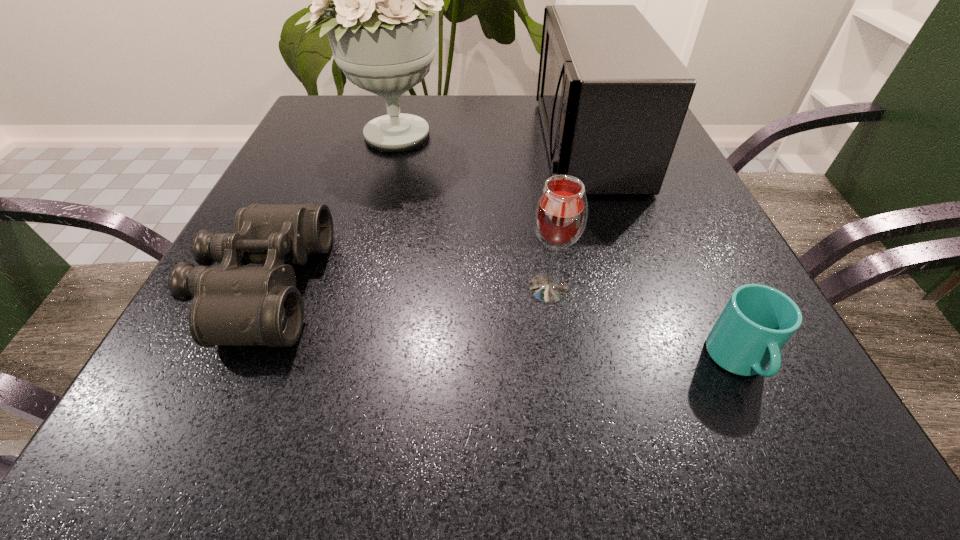
In order to click on bouquet in this screenshot , I will do `click(381, 26)`.

Where is `the fourth shortest object`? the fourth shortest object is located at coordinates (612, 95).

Where is `wineglass`? This screenshot has height=540, width=960. wineglass is located at coordinates tap(560, 213).

This screenshot has width=960, height=540. What are the coordinates of `binoculars` in the screenshot? It's located at (233, 305).

Find the location of `cup`. cup is located at coordinates (757, 321).

This screenshot has height=540, width=960. I want to click on free space located 0.080m on the left of the tallest object, so click(297, 135).

Identify the location of vacant space situated 0.120m on the front-facing side of the microwave_oven. Image resolution: width=960 pixels, height=540 pixels. (487, 144).

The height and width of the screenshot is (540, 960). In order to click on vacant region located 0.330m on the front-facing side of the microwave_oven in this screenshot , I will do `click(393, 144)`.

Where is `vacant space located on the front-facing side of the microwave_oven`? This screenshot has height=540, width=960. vacant space located on the front-facing side of the microwave_oven is located at coordinates pyautogui.click(x=509, y=144).

Identify the location of vacant space located on the front of the wineglass. (561, 371).